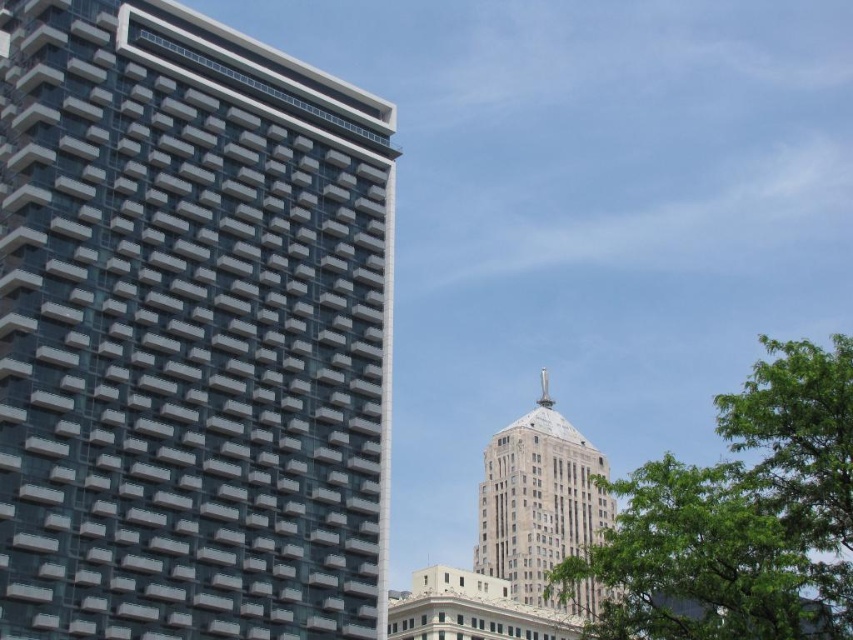
Is point (790, 467) closer to viewer compared to point (518, 492)?

Yes, it is in front of point (518, 492).

Is green leafy tree at center right taller than gray stone tower at center?

Yes, green leafy tree at center right is taller than gray stone tower at center.

Who is more distant from viewer, (669,536) or (525,532)?

Point (525,532)

Find the location of a particular element. The image size is (853, 640). green leafy tree at center right is located at coordinates coord(741,516).

Does glassy reflective building at left have a lesser height compared to gray stone tower at center?

Incorrect, glassy reflective building at left's height does not fall short of gray stone tower at center's.

Who is more forward, (135,349) or (502,486)?

Point (135,349) is more forward.

Locate an element on the screen. The image size is (853, 640). glassy reflective building at left is located at coordinates (189, 332).

Who is lower down, glassy reflective building at left or green leafy tree at center right?

green leafy tree at center right

Does glassy reflective building at left appear under green leafy tree at center right?

No, glassy reflective building at left is not below green leafy tree at center right.

Measure the distance between point (216, 227) and camera.

A distance of 54.96 meters exists between point (216, 227) and camera.

This screenshot has width=853, height=640. In order to click on glassy reflective building at left in this screenshot , I will do [x=189, y=332].